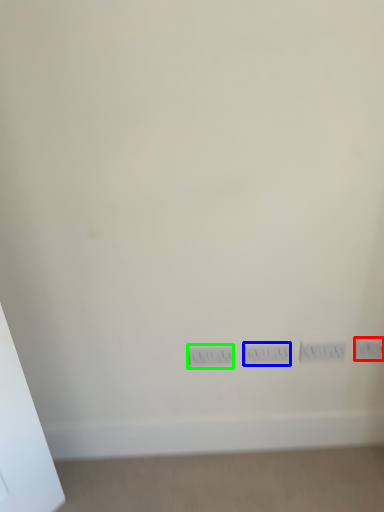
Question: Which object is the farthest from electric outlet (highlighted by a red box)? Choose among these: switch (highlighted by a blue box) or power plugs and sockets (highlighted by a green box).

Choices:
 (A) switch
 (B) power plugs and sockets

Answer: (B)